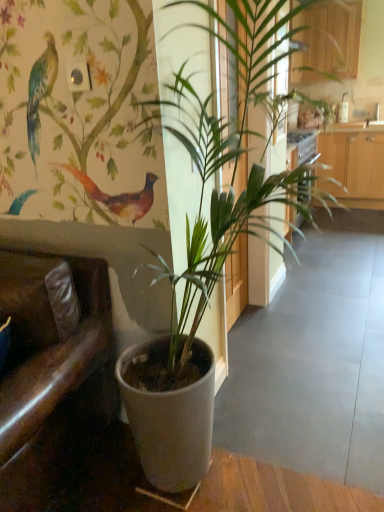
In order to click on green matte plant at center in this screenshot , I will do `click(217, 209)`.

Locate an element on the screen. This screenshot has height=512, width=384. brown leather armchair at left is located at coordinates (52, 369).

Find the location of `furniture that is on the right side of brown leather armchair at left`. furniture that is on the right side of brown leather armchair at left is located at coordinates (328, 40).

Is brown leather armchair at left at the right side of wooden cabinet at upper right?

No, brown leather armchair at left is not to the right of wooden cabinet at upper right.

Between point (85, 348) and point (350, 39), which one is positioned in front?

The point (350, 39) is closer to the camera.

Can you see brown leather armchair at left touching wooden cabinet at upper right?

There is a gap between brown leather armchair at left and wooden cabinet at upper right.

Looking at this image, from a real-world perspective, which object rests below the other?

From a 3D spatial view, brown leather armchair at left is below.

Is brown leather armchair at left taller than green matte plant at center?

No, brown leather armchair at left is not taller than green matte plant at center.

Can you confirm if brown leather armchair at left is wider than green matte plant at center?

Incorrect, the width of brown leather armchair at left does not surpass that of green matte plant at center.

Does brown leather armchair at left lie behind green matte plant at center?

Yes.

Considering the relative sizes of wooden cabinet at upper right and green matte plant at center in the image provided, is wooden cabinet at upper right wider than green matte plant at center?

No, wooden cabinet at upper right is not wider than green matte plant at center.

Is wooden cabinet at upper right taller than green matte plant at center?

Incorrect, the height of wooden cabinet at upper right is not larger of that of green matte plant at center.

Between point (327, 25) and point (307, 200), which one is positioned behind?

Point (307, 200)

Would you say green matte plant at center is outside brown leather armchair at left?

Indeed, green matte plant at center is completely outside brown leather armchair at left.

Considering the sizes of green matte plant at center and brown leather armchair at left in the image, is green matte plant at center bigger or smaller than brown leather armchair at left?

In the image, green matte plant at center appears to be larger than brown leather armchair at left.

Is point (301, 170) less distant than point (27, 372)?

That is False.

You are a GUI agent. You are given a task and a screenshot of the screen. Output one action in this format:
    pyautogui.click(x=<x>, y=<y>)
    Task: Click on the armchair on the left side of green matte plant at center
    Image resolution: width=384 pixels, height=512 pixels.
    Given the screenshot: What is the action you would take?
    pyautogui.click(x=52, y=369)

In the scene shown: Is there a large distance between green matte plant at center and wooden cabinet at upper right?

green matte plant at center is near wooden cabinet at upper right, not far away.

Is green matte plant at center wider than wooden cabinet at upper right?

Yes, green matte plant at center is wider than wooden cabinet at upper right.

Consider the image. Can brown leather armchair at left be found inside wooden cabinet at upper right?

No.

Between wooden cabinet at upper right and brown leather armchair at left, which one is positioned behind?

wooden cabinet at upper right is behind.

Does wooden cabinet at upper right have a larger size compared to brown leather armchair at left?

No.

Locate an element on the screen. This screenshot has height=512, width=384. armchair in front of the wooden cabinet at upper right is located at coordinates (52, 369).

Image resolution: width=384 pixels, height=512 pixels. What are the coordinates of `houseplant that is above the brown leather armchair at left (from the image's perspective)` in the screenshot? It's located at (217, 209).

Based on their spatial positions, is green matte plant at center or wooden cabinet at upper right further from brown leather armchair at left?

The object further to brown leather armchair at left is wooden cabinet at upper right.

In the scene shown: Estimate the real-world distances between objects in this image. Which object is closer to green matte plant at center, wooden cabinet at upper right or brown leather armchair at left?

The object closer to green matte plant at center is brown leather armchair at left.

Considering their positions, is brown leather armchair at left positioned further to green matte plant at center than wooden cabinet at upper right?

wooden cabinet at upper right is positioned further to the anchor green matte plant at center.

Looking at the image, which one is located further to brown leather armchair at left, wooden cabinet at upper right or green matte plant at center?

wooden cabinet at upper right is further to brown leather armchair at left.

Looking at this image, estimate the real-world distances between objects in this image. Which object is closer to wooden cabinet at upper right, brown leather armchair at left or green matte plant at center?

green matte plant at center lies closer to wooden cabinet at upper right than the other object.

Looking at the image, which one is located closer to wooden cabinet at upper right, green matte plant at center or brown leather armchair at left?

green matte plant at center lies closer to wooden cabinet at upper right than the other object.

Locate an element on the screen. The image size is (384, 512). armchair between green matte plant at center and wooden cabinet at upper right in the front-back direction is located at coordinates (52, 369).